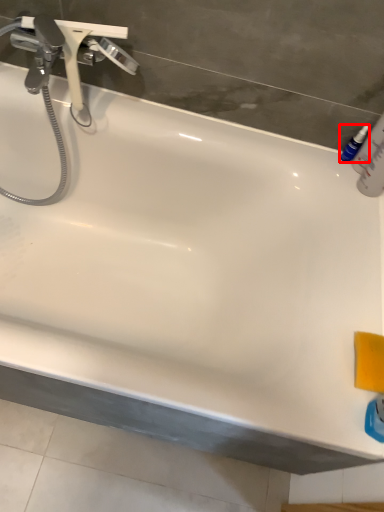
Question: In this image, where is mouthwash (annotated by the red box) located relative to tap?

Choices:
 (A) left
 (B) right

Answer: (B)